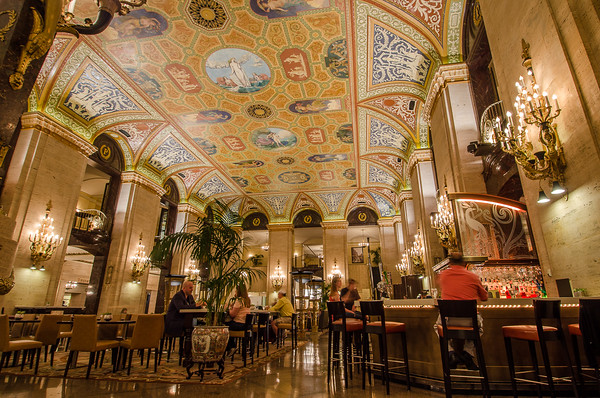
Identify the location of carpet. The width and height of the screenshot is (600, 398). (156, 373), (321, 334), (12, 363).